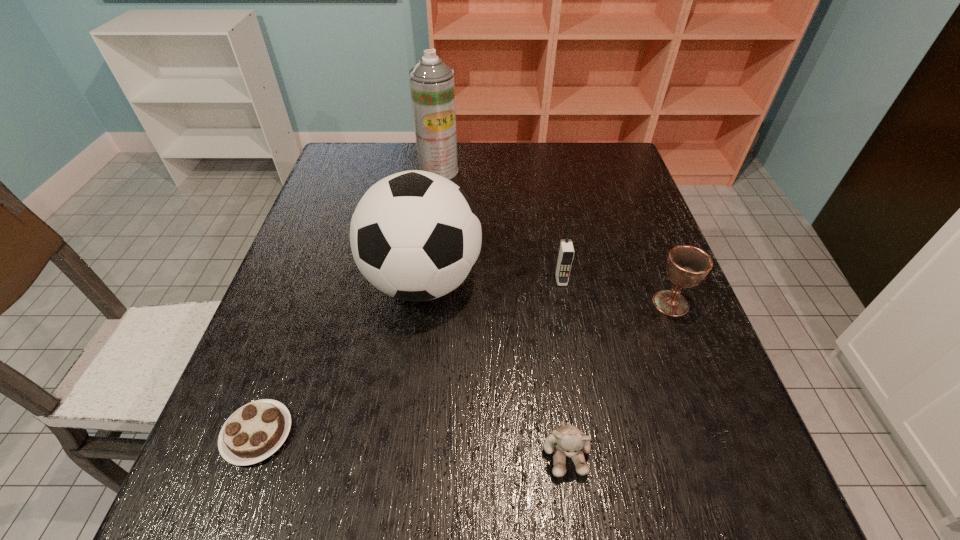
Identify the location of vacant space that's between the fifth shortest object and the shortest object. The width and height of the screenshot is (960, 540). click(x=340, y=357).

Where is `vacant space that is in between the fifth tallest object and the cellular telephone`? The width and height of the screenshot is (960, 540). vacant space that is in between the fifth tallest object and the cellular telephone is located at coordinates (564, 366).

The image size is (960, 540). I want to click on unoccupied area between the chocolate cake and the tallest object, so click(x=348, y=302).

In order to click on vacant space that's between the rightmost object and the second shortest object in this screenshot , I will do `click(618, 378)`.

Point out which object is positioned as the second nearest to the fifth shortest object. Please provide its 2D coordinates. Your answer should be formatted as a tuple, i.e. [(x, y)], where the tuple contains the x and y coordinates of a point satisfying the conditions above.

[(255, 431)]

Identify the location of the second closest object to the tallest object. The height and width of the screenshot is (540, 960). (566, 252).

Image resolution: width=960 pixels, height=540 pixels. I want to click on vacant space that satisfies the following two spatial constraints: 1. on the front-facing side of the cellular telephone; 2. on the left side of the chalice, so click(x=565, y=303).